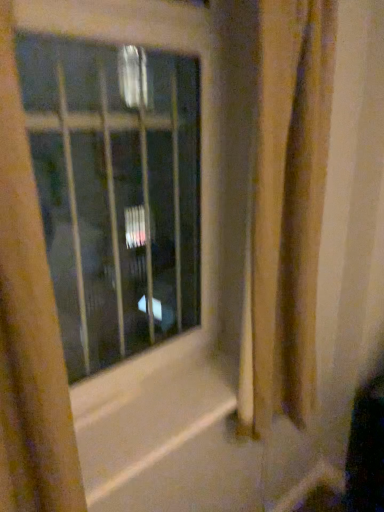
Question: Is brown textured shower curtain at right touching transparent glass window at center?

Choices:
 (A) no
 (B) yes

Answer: (A)

Question: From the image's perspective, is brown textured shower curtain at right above transparent glass window at center?

Choices:
 (A) yes
 (B) no

Answer: (B)

Question: Considering the relative sizes of brown textured shower curtain at right and transparent glass window at center in the image provided, is brown textured shower curtain at right thinner than transparent glass window at center?

Choices:
 (A) yes
 (B) no

Answer: (B)

Question: Can you confirm if brown textured shower curtain at right is positioned to the right of transparent glass window at center?

Choices:
 (A) yes
 (B) no

Answer: (A)

Question: Would you say brown textured shower curtain at right contains transparent glass window at center?

Choices:
 (A) no
 (B) yes

Answer: (A)

Question: Considering the positions of brown textured shower curtain at right and transparent glass window at center in the image, is brown textured shower curtain at right bigger or smaller than transparent glass window at center?

Choices:
 (A) small
 (B) big

Answer: (B)

Question: Based on their positions, is brown textured shower curtain at right located to the left or right of transparent glass window at center?

Choices:
 (A) left
 (B) right

Answer: (B)

Question: Is brown textured shower curtain at right taller or shorter than transparent glass window at center?

Choices:
 (A) tall
 (B) short

Answer: (A)

Question: Considering the positions of brown textured shower curtain at right and transparent glass window at center in the image, is brown textured shower curtain at right wider or thinner than transparent glass window at center?

Choices:
 (A) thin
 (B) wide

Answer: (B)

Question: Does point pos(18,242) appear closer or farther from the camera than point pos(57,307)?

Choices:
 (A) farther
 (B) closer

Answer: (B)

Question: In terms of size, does yellow textured curtain at left appear bigger or smaller than transparent glass window at center?

Choices:
 (A) small
 (B) big

Answer: (B)

Question: From a real-world perspective, relative to transparent glass window at center, is yellow textured curtain at left vertically above or below?

Choices:
 (A) above
 (B) below

Answer: (B)

Question: From the image's perspective, is yellow textured curtain at left positioned above or below transparent glass window at center?

Choices:
 (A) below
 (B) above

Answer: (A)

Question: Looking at their shapes, would you say yellow textured curtain at left is wider or thinner than brown textured shower curtain at right?

Choices:
 (A) thin
 (B) wide

Answer: (B)

Question: Does point (54, 500) appear closer or farther from the camera than point (276, 16)?

Choices:
 (A) closer
 (B) farther

Answer: (A)